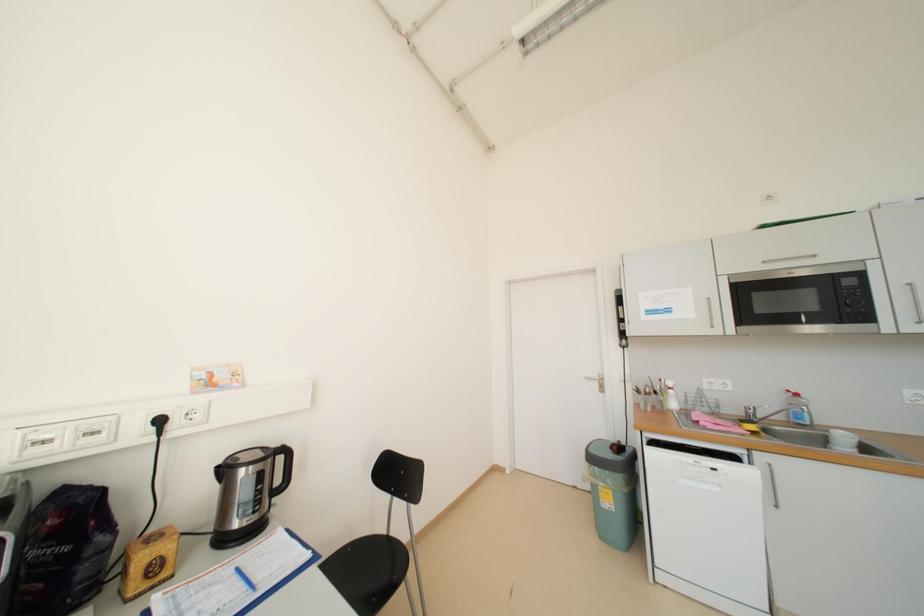
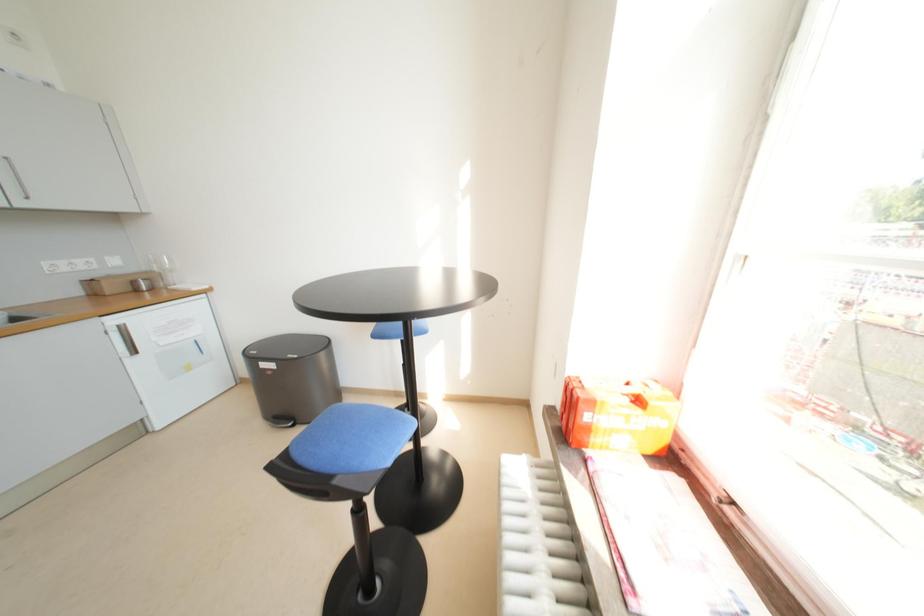
Question: The images are taken continuously from a first-person perspective. In which direction is your viewpoint rotating?

Choices:
 (A) Left
 (B) Right
 (C) Up
 (D) Down

Answer: (B)